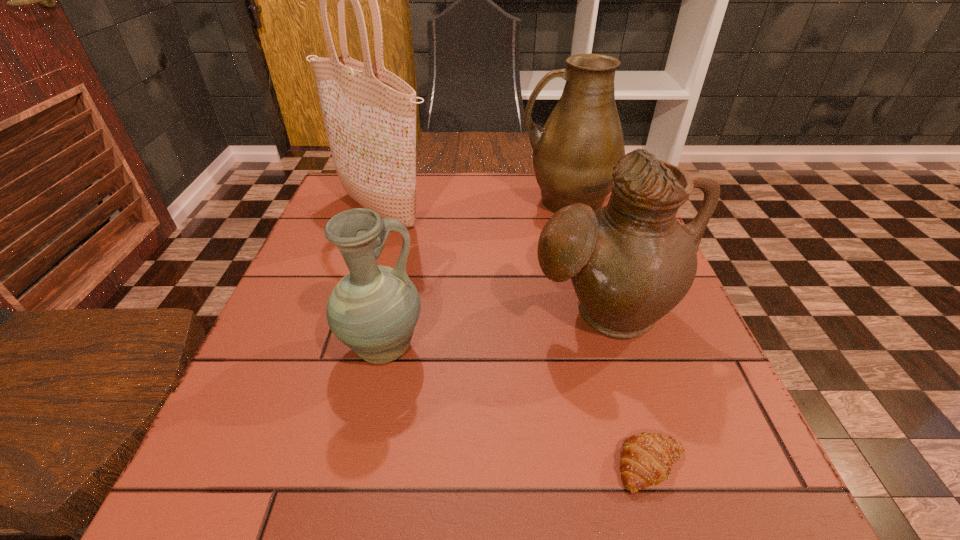
Find the location of a particular element. This screenshot has height=540, width=960. free space located 0.340m on the handle side of the shortest pitcher is located at coordinates coord(616,349).

Image resolution: width=960 pixels, height=540 pixels. What are the coordinates of `free space located 0.180m on the left of the shortest object` in the screenshot? It's located at point(490,465).

Locate an element on the screen. The height and width of the screenshot is (540, 960). shopping bag that is at the far edge is located at coordinates (369, 113).

The width and height of the screenshot is (960, 540). I want to click on pitcher present at the far edge, so click(x=574, y=153).

The width and height of the screenshot is (960, 540). I want to click on object that is at the near edge, so click(646, 459).

Identify the location of shopping bag at the left edge. (369, 113).

The width and height of the screenshot is (960, 540). Find the location of `pitcher present at the left edge`. pitcher present at the left edge is located at coordinates (373, 310).

Image resolution: width=960 pixels, height=540 pixels. I want to click on crescent roll that is positioned at the right edge, so click(646, 459).

Where is `object present at the far left corner`? This screenshot has width=960, height=540. object present at the far left corner is located at coordinates click(369, 113).

The height and width of the screenshot is (540, 960). I want to click on object at the far right corner, so click(x=574, y=153).